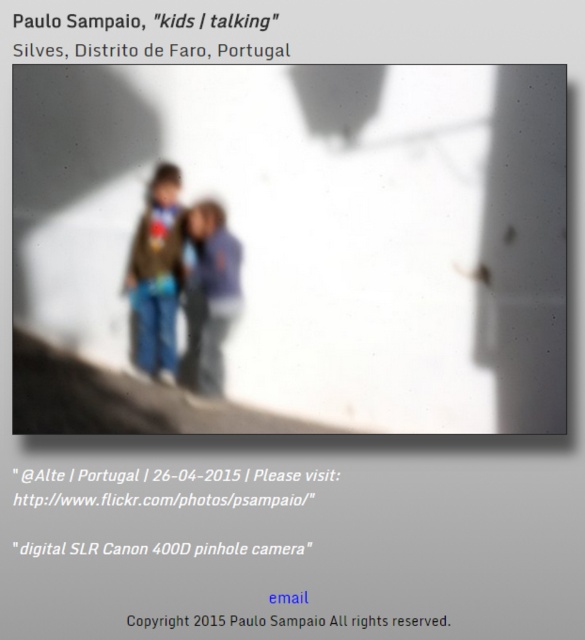
The height and width of the screenshot is (640, 585). What do you see at coordinates (180, 284) in the screenshot? I see `matte brown jacket at center` at bounding box center [180, 284].

Is matte brown jacket at center to the right of matte blue jeans at center from the viewer's perspective?

In fact, matte brown jacket at center is to the left of matte blue jeans at center.

Is point (215, 340) more distant than point (208, 394)?

Yes, point (215, 340) is farther from viewer.

Locate an element on the screen. Image resolution: width=585 pixels, height=640 pixels. matte brown jacket at center is located at coordinates (180, 284).